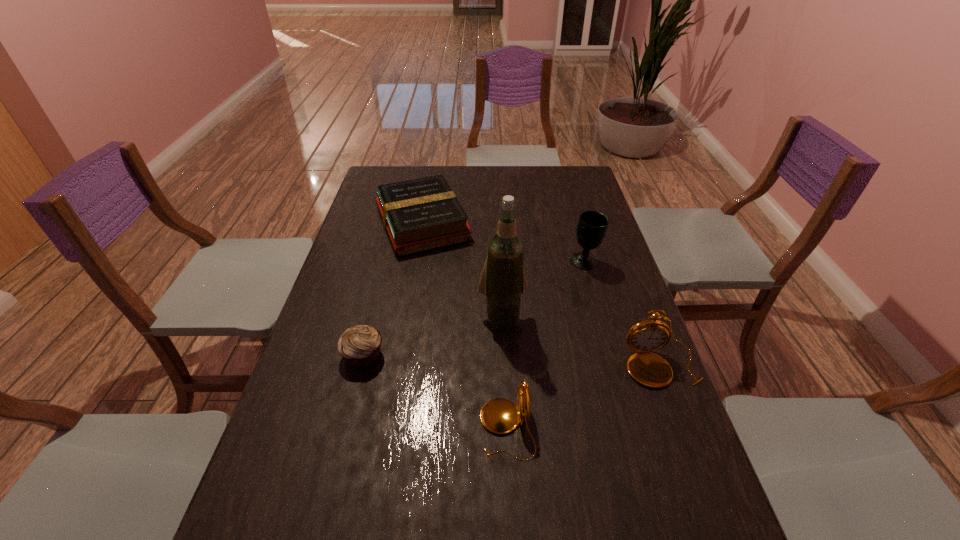
Please point a spot on the left to add another pocket watch. Please provide its 2D coordinates. Your answer should be formatted as a tuple, i.e. [(x, y)], where the tuple contains the x and y coordinates of a point satisfying the conditions above.

[(305, 511)]